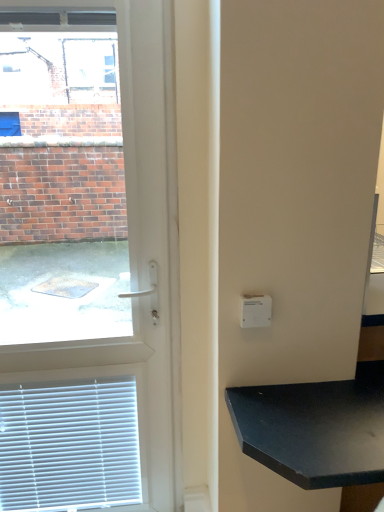
Question: From their relative heights in the image, would you say white plastic light switch at upper right is taller or shorter than black matte table at lower right?

Choices:
 (A) short
 (B) tall

Answer: (A)

Question: In the image, is white plastic light switch at upper right positioned in front of or behind black matte table at lower right?

Choices:
 (A) behind
 (B) front

Answer: (A)

Question: Which object is the farthest from the black matte table at lower right?

Choices:
 (A) white plastic light switch at upper right
 (B) white plastic door at left

Answer: (B)

Question: Considering the real-world distances, which object is closest to the black matte table at lower right?

Choices:
 (A) white plastic door at left
 (B) white plastic light switch at upper right

Answer: (B)